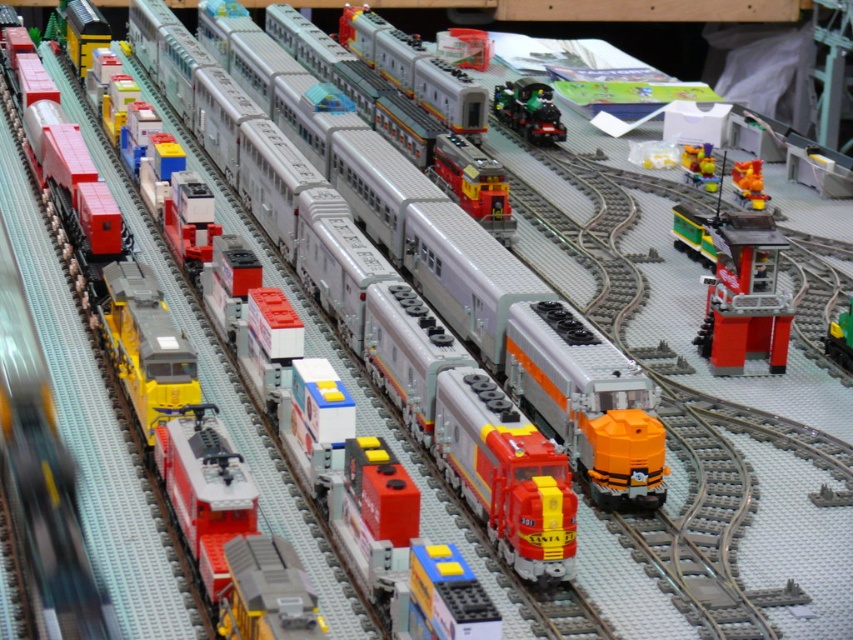
Question: Which object is farther from the camera taking this photo?

Choices:
 (A) orange matte train at upper right
 (B) shiny green metal train at upper right

Answer: (B)

Question: Is brick red plastic train station at right smaller than green plastic toy at center?

Choices:
 (A) no
 (B) yes

Answer: (A)

Question: Which point is farther to the camera?

Choices:
 (A) green plastic toy at center
 (B) matte plastic train at center
 (C) translucent yellow toy at center
 (D) shiny red train at center

Answer: (C)

Question: Can you confirm if brick red plastic train station at right is smaller than green plastic toy at center?

Choices:
 (A) yes
 (B) no

Answer: (B)

Question: Is orange matte train at upper right to the right of green plastic toy at center from the viewer's perspective?

Choices:
 (A) yes
 (B) no

Answer: (B)

Question: Estimate the real-world distances between objects in this image. Which object is farther from the shiny green metal train at upper right?

Choices:
 (A) brick red plastic train station at right
 (B) orange matte train at upper right

Answer: (A)